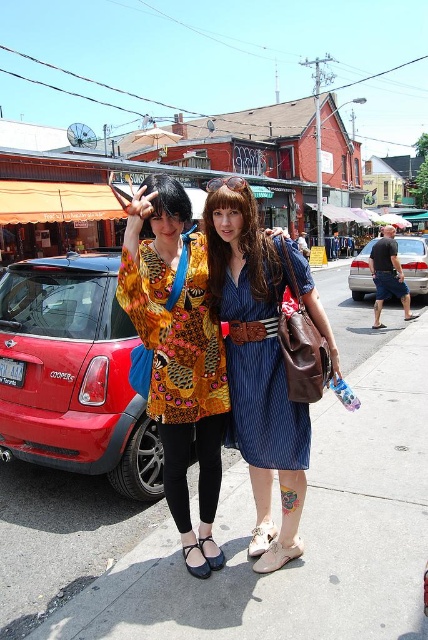
Question: Which object is positioned closest to the matte black sandal at lower center?

Choices:
 (A) printed silk dress at center
 (B) silver metallic sedan at right
 (C) shiny red car at left
 (D) white leather sandal at lower center

Answer: (D)

Question: Does denim skirt at center appear under black leather sandal at lower center?

Choices:
 (A) no
 (B) yes

Answer: (A)

Question: Does dark blue denim shorts at right have a larger size compared to white leather sandal at lower center?

Choices:
 (A) no
 (B) yes

Answer: (B)

Question: Is blue striped dress at center closer to camera compared to denim skirt at center?

Choices:
 (A) yes
 (B) no

Answer: (B)

Question: Which of these objects is positioned closest to the dark blue denim shorts at right?

Choices:
 (A) denim dress at center
 (B) printed fabric blouse at center
 (C) white leather sandal at lower center
 (D) black leather sandal at lower center

Answer: (A)

Question: Based on their relative distances, which object is farther from the printed fabric blouse at center?

Choices:
 (A) printed silk dress at center
 (B) silver metallic sedan at right
 (C) denim dress at center
 (D) black leather sandal at lower center

Answer: (B)